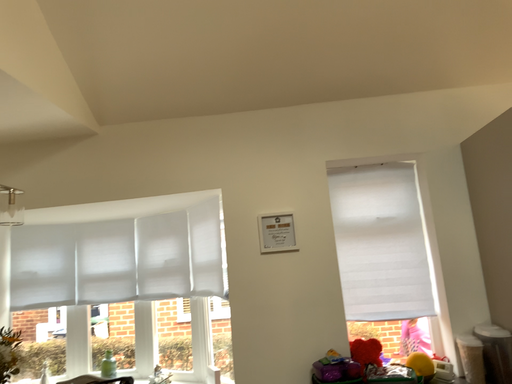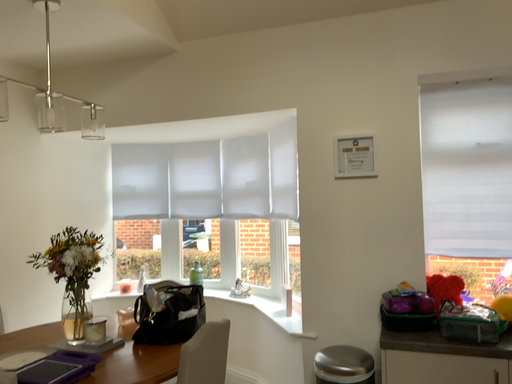
Question: How did the camera likely rotate when shooting the video?

Choices:
 (A) rotated left
 (B) rotated right

Answer: (A)